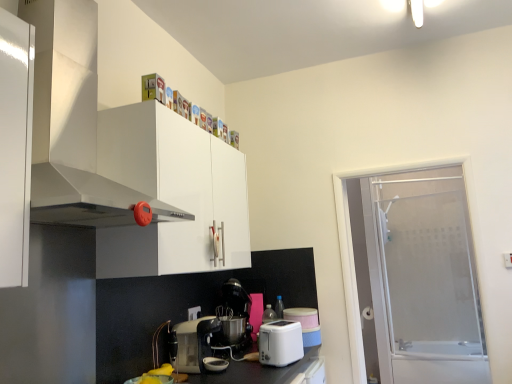
Question: Is white glossy range hood at upper left spatially inside frosted glass screen door at right, or outside of it?

Choices:
 (A) inside
 (B) outside

Answer: (B)

Question: Relative to frosted glass screen door at right, is white glossy range hood at upper left in front or behind?

Choices:
 (A) front
 (B) behind

Answer: (A)

Question: Based on their relative distances, which object is farther from the white glossy range hood at upper left?

Choices:
 (A) metallic silver coffee maker at center, the 2th kitchen appliance viewed from the right
 (B) white plastic electric outlet at lower center
 (C) white plastic toaster at lower center, the 1th kitchen appliance in the right-to-left sequence
 (D) white glossy cabinet at upper center
 (E) metallic silver coffee machine at center

Answer: (E)

Question: Based on their relative distances, which object is farther from the white plastic toaster at lower center, the 1th kitchen appliance in the right-to-left sequence?

Choices:
 (A) metallic silver coffee machine at center
 (B) white glossy cabinet at upper center
 (C) white plastic electric outlet at lower center
 (D) metallic silver coffee maker at center, the 2th kitchen appliance viewed from the right
 (E) white glossy range hood at upper left

Answer: (E)